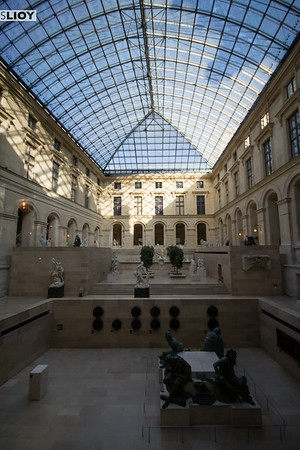
Identify the location of light. (24, 204).